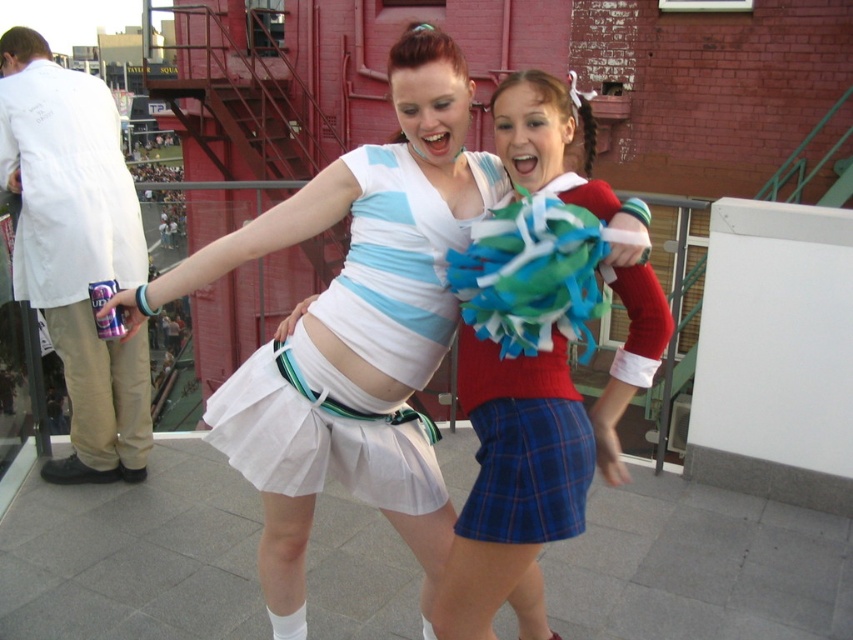
Describe the element at coordinates (538, 458) in the screenshot. I see `plaid fabric skirt at center` at that location.

Is point (556, 449) in front of point (525, 522)?

No.

Is point (531, 536) more distant than point (500, 536)?

No.

Image resolution: width=853 pixels, height=640 pixels. I want to click on plaid fabric skirt at center, so click(x=538, y=458).

Does white matte skirt at center appear over blue plaid skirt at lower center?

Yes, white matte skirt at center is above blue plaid skirt at lower center.

Does white matte skirt at center have a larger size compared to blue plaid skirt at lower center?

Yes, white matte skirt at center is bigger than blue plaid skirt at lower center.

The width and height of the screenshot is (853, 640). What do you see at coordinates (354, 330) in the screenshot?
I see `white matte skirt at center` at bounding box center [354, 330].

You are a GUI agent. You are given a task and a screenshot of the screen. Output one action in this format:
    pyautogui.click(x=<x>, y=<y>)
    Task: Click on the white matte skirt at center
    
    Given the screenshot: What is the action you would take?
    pyautogui.click(x=354, y=330)

Between plaid fabric skirt at center and white pleated skirt at center, which one has less height?

white pleated skirt at center

Is point (666, 308) closer to viewer compared to point (381, 460)?

Yes, it is.

What do you see at coordinates (538, 458) in the screenshot?
I see `plaid fabric skirt at center` at bounding box center [538, 458].

I want to click on plaid fabric skirt at center, so 538,458.